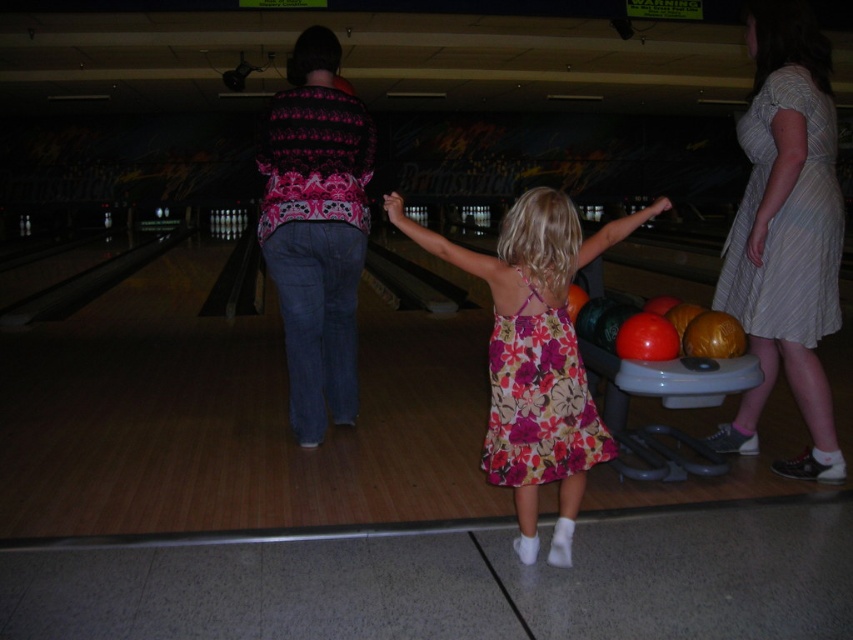
Does point (801, 173) lie in front of point (567, 412)?

No, (801, 173) is behind (567, 412).

Can you confirm if white striped dress at right is bigger than floral print fabric dress at center?

Yes.

You are a GUI agent. You are given a task and a screenshot of the screen. Output one action in this format:
    pyautogui.click(x=<x>, y=<y>)
    Task: Click on the white striped dress at right
    Image resolution: width=853 pixels, height=640 pixels.
    Given the screenshot: What is the action you would take?
    pyautogui.click(x=786, y=221)

In order to click on white striped dress at right in this screenshot , I will do `click(786, 221)`.

Can you confirm if floral dress at center is positioned above floral print fabric dress at center?

Indeed, floral dress at center is positioned over floral print fabric dress at center.

At what (x,y) coordinates should I click in order to perform the action: click on floral dress at center. Please return your answer as a coordinate pair (x, y). The image size is (853, 640). Looking at the image, I should click on (535, 355).

Is pink sweater at center to the right of floral print fabric dress at center from the viewer's perspective?

Incorrect, pink sweater at center is not on the right side of floral print fabric dress at center.

Between point (344, 168) and point (548, 326), which one is positioned in front?

Point (548, 326)

Where is `pink sweater at center`? The height and width of the screenshot is (640, 853). pink sweater at center is located at coordinates (316, 228).